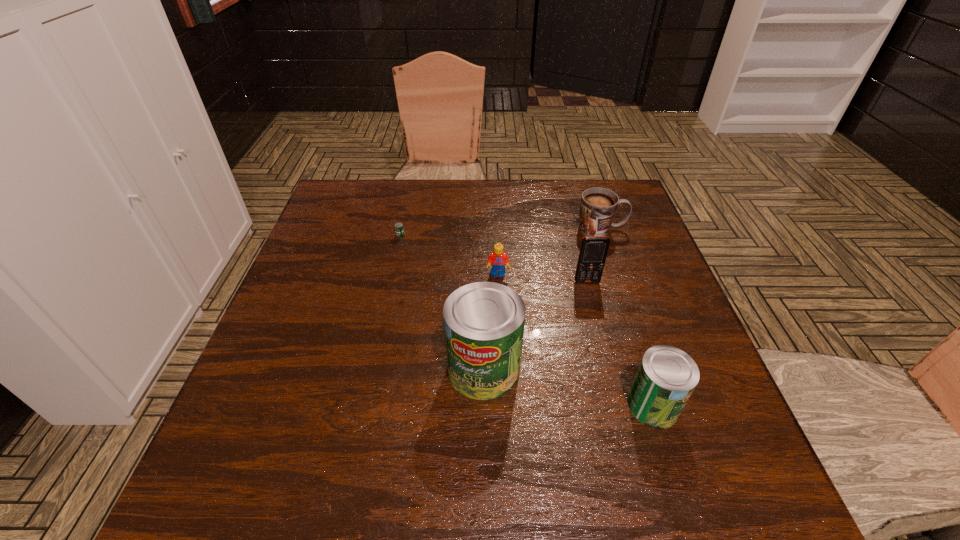
Considering the uniform spacing of cans, where should an additional can be positioned on the left? Please locate a free spot. Please provide its 2D coordinates. Your answer should be formatted as a tuple, i.e. [(x, y)], where the tuple contains the x and y coordinates of a point satisfying the conditions above.

[(336, 339)]